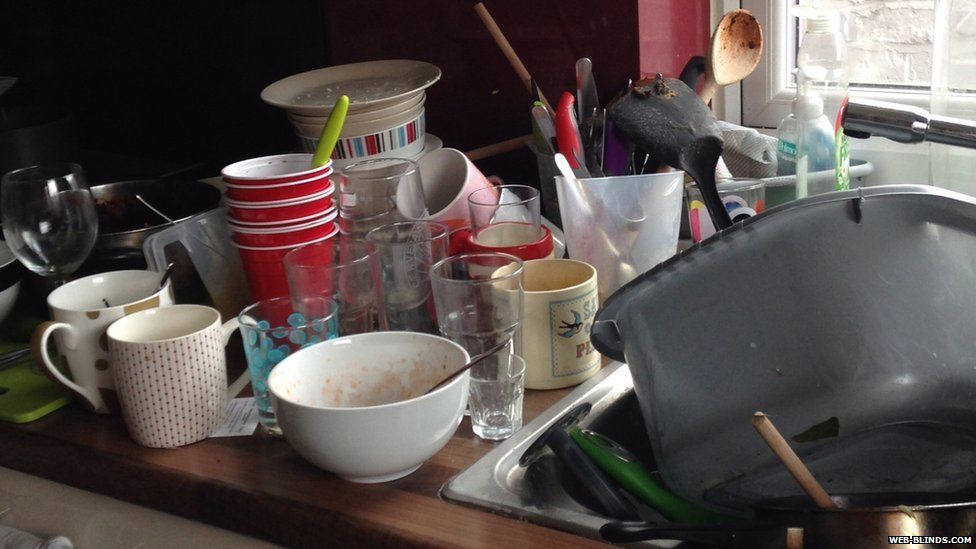
I want to click on dirty plate, so click(392, 89).